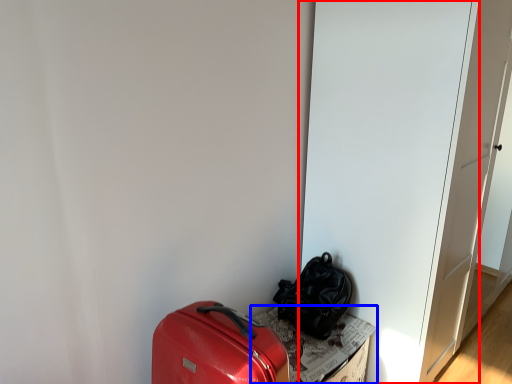
Question: Which point is further to the camera, door (highlighted by a red box) or cardboard box (highlighted by a blue box)?

Choices:
 (A) door
 (B) cardboard box

Answer: (B)